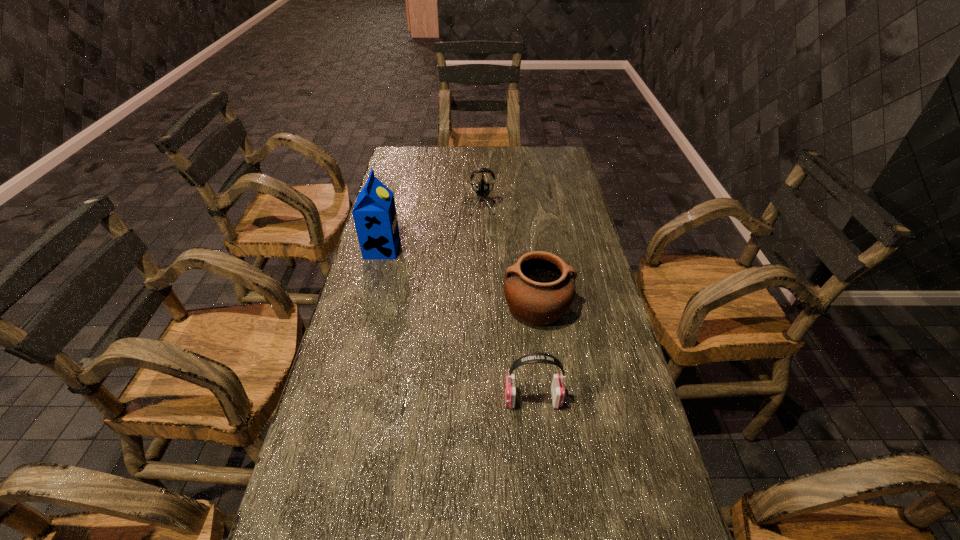
This screenshot has width=960, height=540. Find the location of `empty location between the third nearest object and the pottery`. empty location between the third nearest object and the pottery is located at coordinates pyautogui.click(x=460, y=278).

The image size is (960, 540). I want to click on free area in between the nearer earphone and the third object from right to left, so click(x=506, y=303).

Identify the location of empty space that is in between the farther earphone and the right earphone. The image size is (960, 540). (506, 303).

In order to click on free spot between the farthest object and the leftmost object in this screenshot , I will do `click(431, 227)`.

The image size is (960, 540). Identify the location of vacant space that's between the second farthest object and the second nearest object. (460, 278).

I want to click on object identified as the second closest to the third object from right to left, so click(539, 288).

Where is `the third closest object to the farther earphone`? the third closest object to the farther earphone is located at coordinates (557, 387).

The width and height of the screenshot is (960, 540). I want to click on blank space that satisfies the following two spatial constraints: 1. on the front side of the farthest object; 2. with the cap open on the tallest object, so click(x=479, y=249).

Locate an element on the screen. Image resolution: width=960 pixels, height=540 pixels. free space that satisfies the following two spatial constraints: 1. with the cap open on the tallest object; 2. on the left side of the pottery is located at coordinates (368, 307).

Locate an element on the screen. This screenshot has height=540, width=960. vacant point that satisfies the following two spatial constraints: 1. with the cap open on the leftmost object; 2. on the right side of the second nearest object is located at coordinates (368, 307).